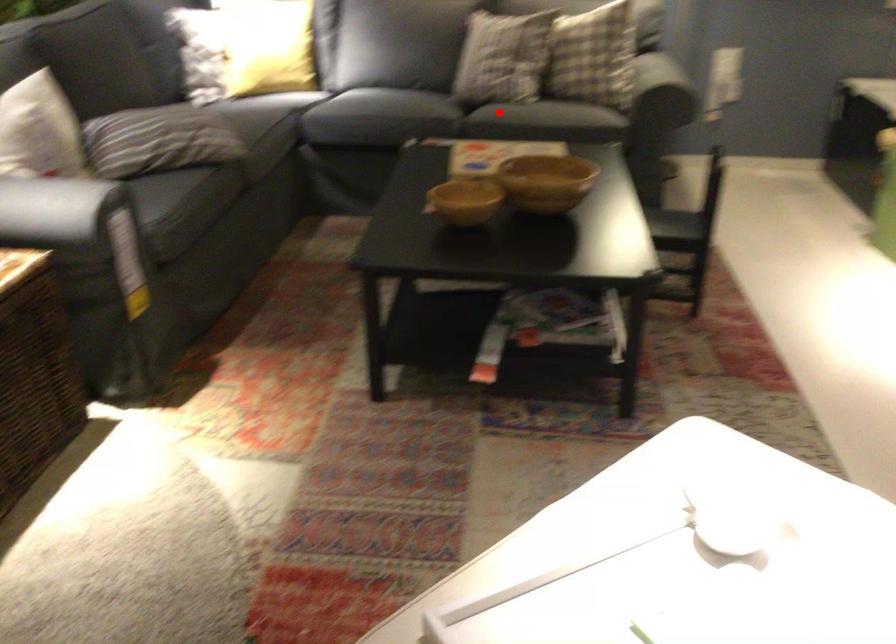
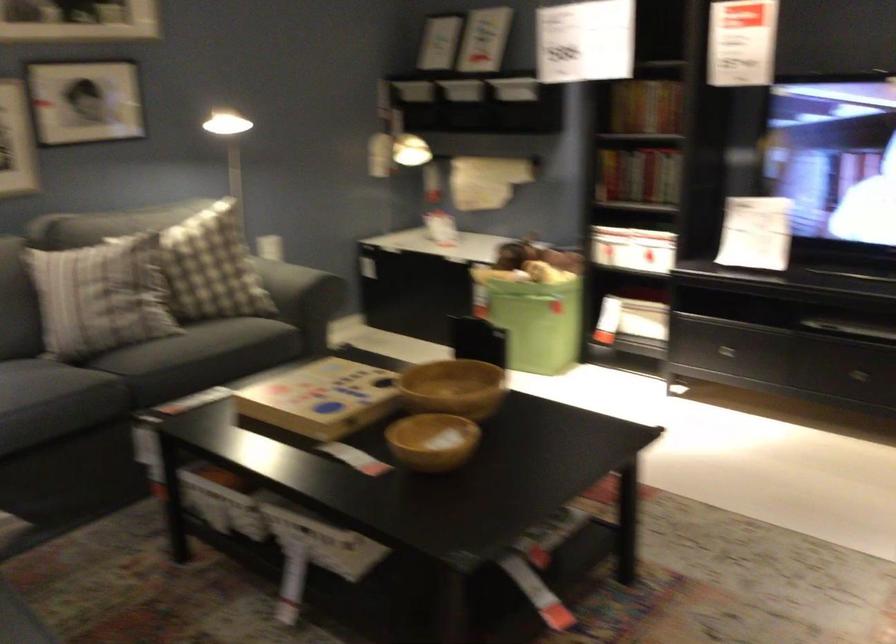
Find the pixel in the second image that matches the highlighted location in the first image.

(199, 357)